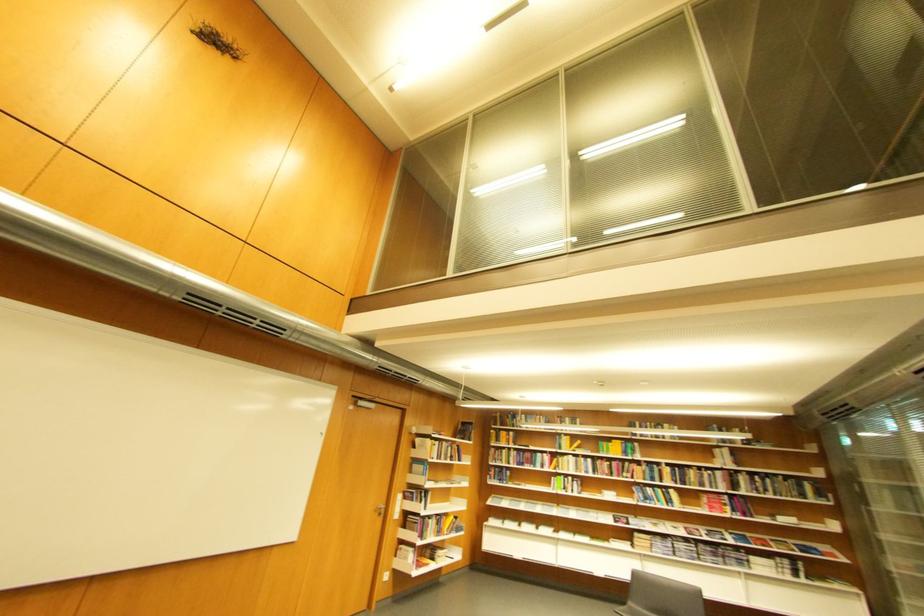
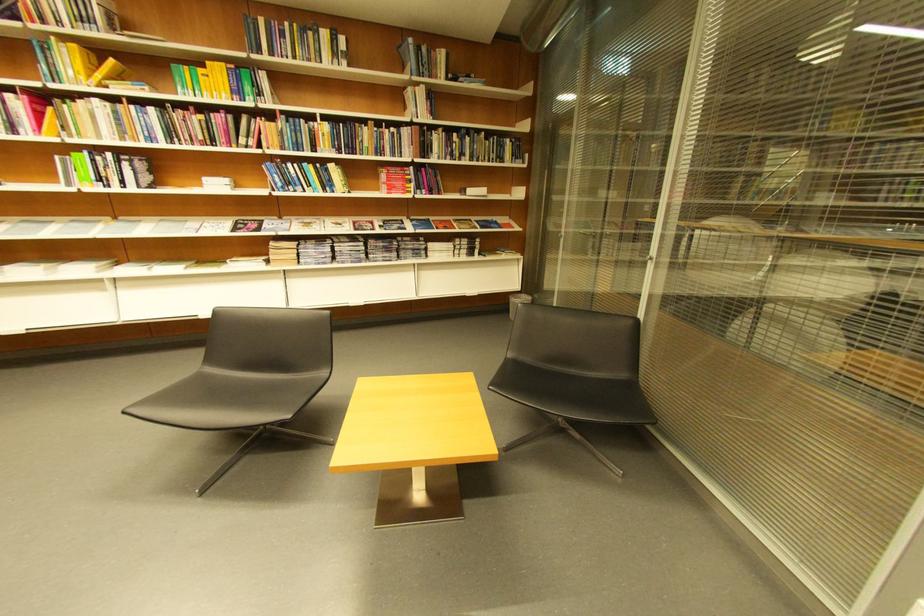
The point at (578,439) is marked in the first image. Where is the corresponding point in the second image?

(84, 47)